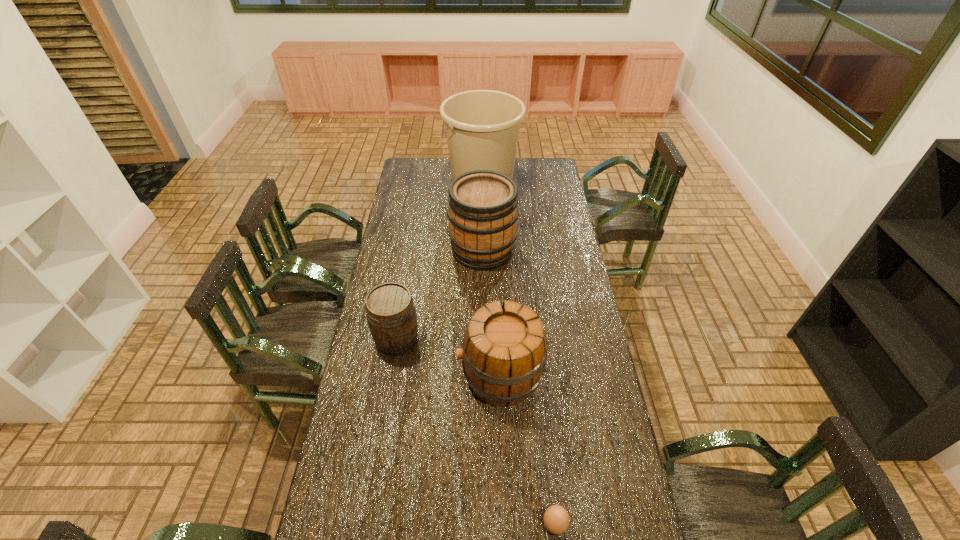
At what (x,y) coordinates should I click in order to perform the action: click on bucket. Please return your answer as a coordinate pair (x, y). The width and height of the screenshot is (960, 540). Looking at the image, I should click on (482, 127).

I want to click on the tallest object, so click(x=482, y=127).

At what (x,y) coordinates should I click in order to perform the action: click on the fourth shortest object. Please return your answer as a coordinate pair (x, y). The height and width of the screenshot is (540, 960). Looking at the image, I should click on (483, 210).

Find the location of a particular element. The image size is (960, 540). the farthest cider is located at coordinates (483, 210).

Locate an element on the screen. the shortest cider is located at coordinates pyautogui.click(x=391, y=315).

I want to click on the leftmost object, so click(x=391, y=315).

This screenshot has width=960, height=540. What are the coordinates of `the shortest object` in the screenshot? It's located at (556, 519).

At what (x,y) coordinates should I click in order to perform the action: click on the nearest object. Please return your answer as a coordinate pair (x, y). Looking at the image, I should click on (x=556, y=519).

This screenshot has width=960, height=540. I want to click on vacant space located on the left of the farthest object, so click(423, 178).

Where is `free region located on the left of the second tallest object`? This screenshot has width=960, height=540. free region located on the left of the second tallest object is located at coordinates (403, 249).